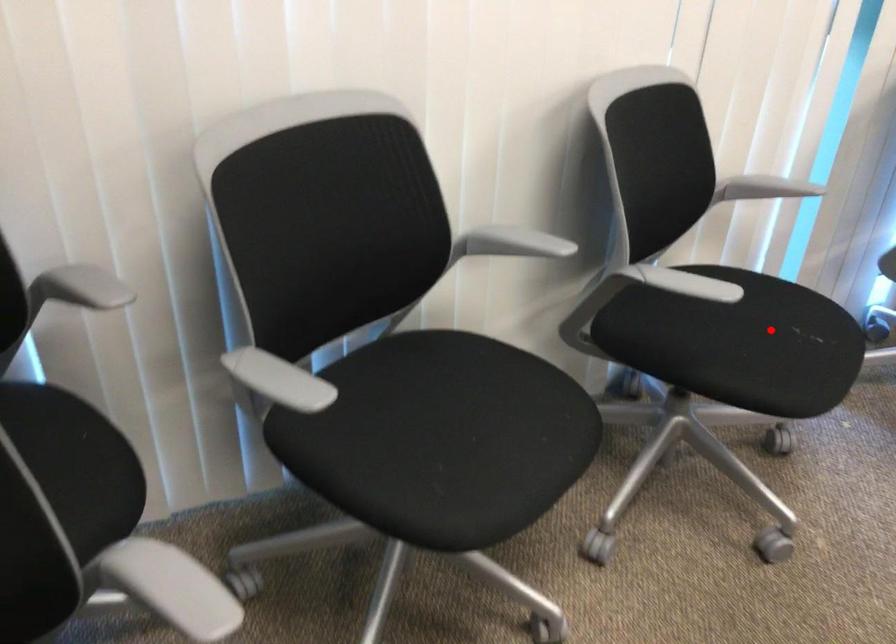
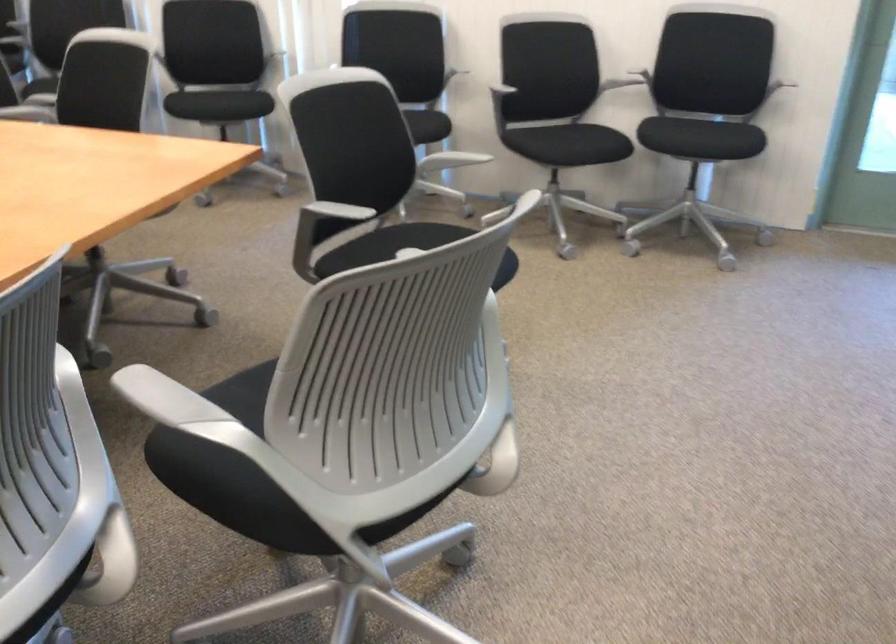
Find the pixel in the second image that matches the highlighted location in the first image.

(238, 102)